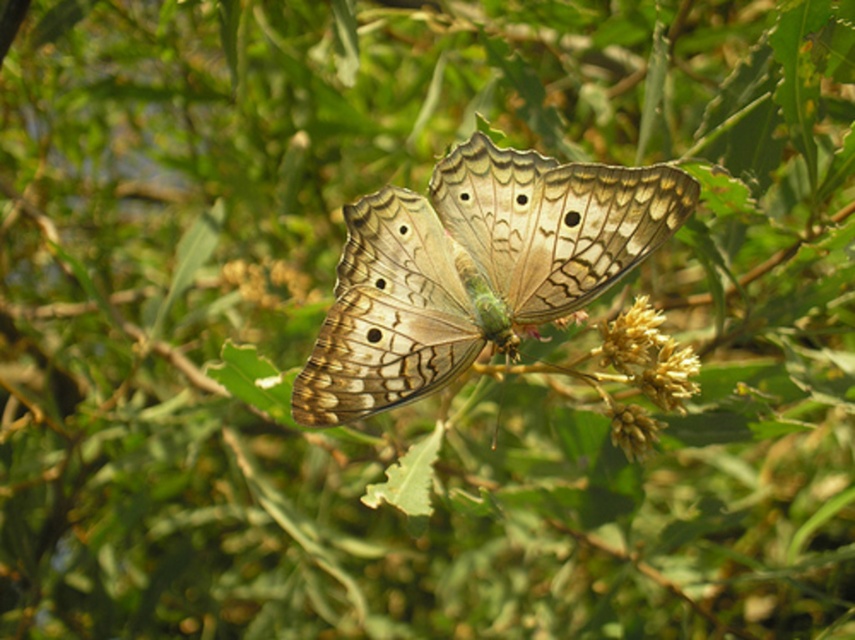
You are holding a camera and want to take a closeup photo of the brown textured butterfly at center. The camera requires the subject to be at least 1.5 meters away to focus properly. Based on the scene, will the butterfly be in focus?

The brown textured butterfly at center is 1.34 meters from the camera, which is closer than the required 1.5 meters. Therefore, the butterfly will not be in focus.